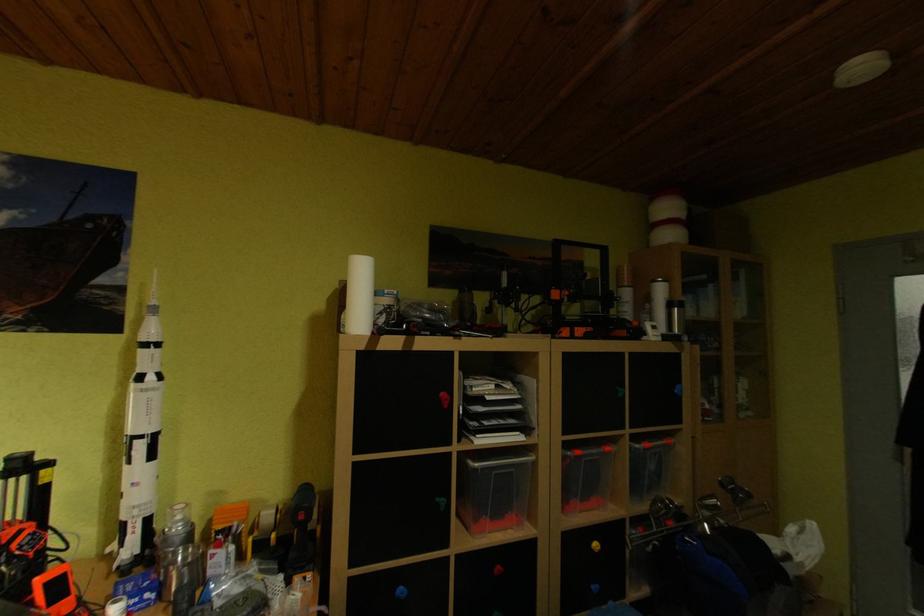
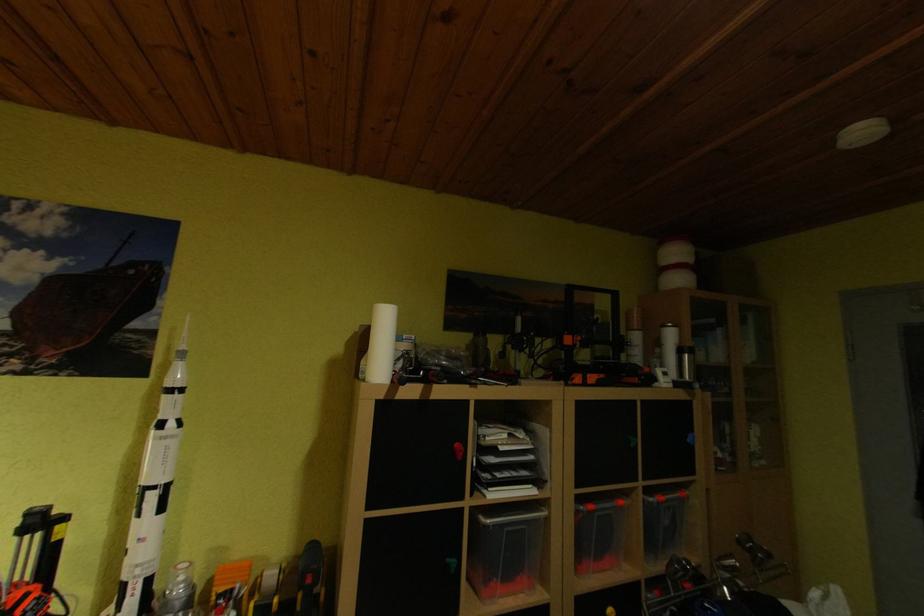
Which direction would the cameraman need to move to produce the second image?

The cameraman moved toward left, backward.